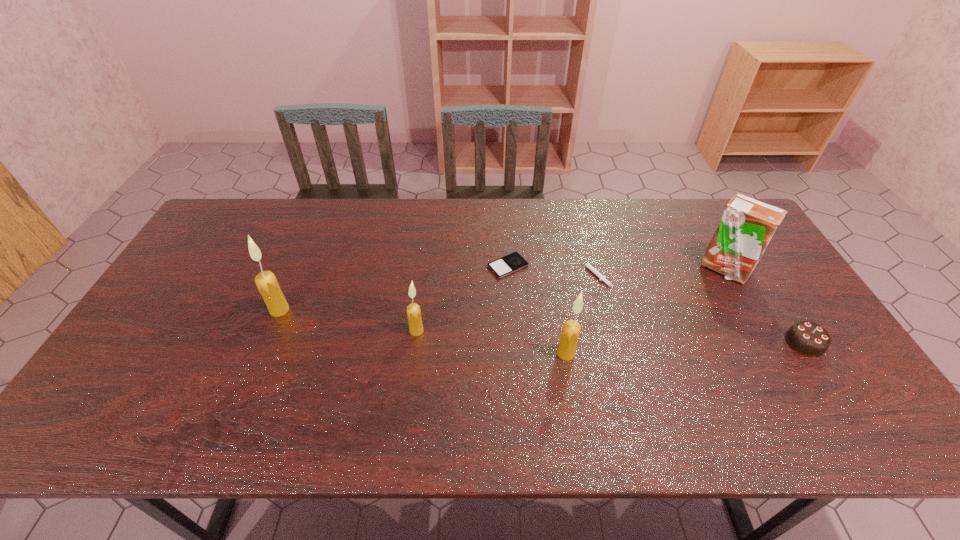
Where is `the leftmost candle`? This screenshot has height=540, width=960. the leftmost candle is located at coordinates (267, 284).

This screenshot has height=540, width=960. I want to click on the leftmost object, so click(x=267, y=284).

The width and height of the screenshot is (960, 540). Find the location of `the fourth tallest object`. the fourth tallest object is located at coordinates (413, 310).

You are a GUI agent. You are given a task and a screenshot of the screen. Output one action in this format:
    pyautogui.click(x=<x>, y=<y>)
    Task: Click on the shortest candle
    Image resolution: width=960 pixels, height=540 pixels.
    Given the screenshot: What is the action you would take?
    pyautogui.click(x=413, y=310)

You are a GUI agent. You are given a task and a screenshot of the screen. Output one action in this format:
    pyautogui.click(x=<x>, y=<y>)
    Task: Click on the fourth object from left to right
    
    Given the screenshot: What is the action you would take?
    pyautogui.click(x=571, y=329)

Find the location of a particular element. This screenshot has height=540, width=960. the rightmost candle is located at coordinates (571, 329).

Where is `carton`? carton is located at coordinates (747, 225).

The width and height of the screenshot is (960, 540). In order to click on the shortest object in this screenshot , I will do `click(513, 262)`.

Identify the location of iPod. This screenshot has height=540, width=960. (513, 262).

Find the location of a particular element. the third shortest object is located at coordinates (807, 338).